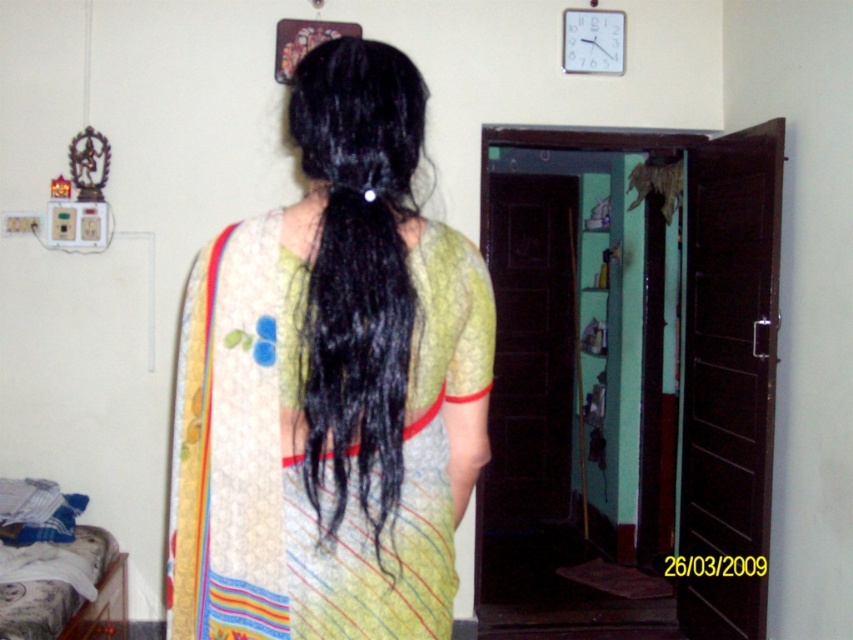
Question: Considering the relative positions of silky yellow sari at center and black silky hair at center in the image provided, where is silky yellow sari at center located with respect to black silky hair at center?

Choices:
 (A) above
 (B) below

Answer: (B)

Question: Is silky yellow sari at center below black silky hair at center?

Choices:
 (A) no
 (B) yes

Answer: (B)

Question: Which point is farther from the camera taking this photo?

Choices:
 (A) (317, 273)
 (B) (350, 160)

Answer: (B)

Question: Observing the image, what is the correct spatial positioning of silky yellow sari at center in reference to black silky hair at center?

Choices:
 (A) above
 (B) below

Answer: (B)

Question: Which point is farther to the camera?

Choices:
 (A) silky yellow sari at center
 (B) black silky hair at center

Answer: (B)

Question: Which point is closer to the camera taking this photo?

Choices:
 (A) (408, 157)
 (B) (378, 305)

Answer: (B)